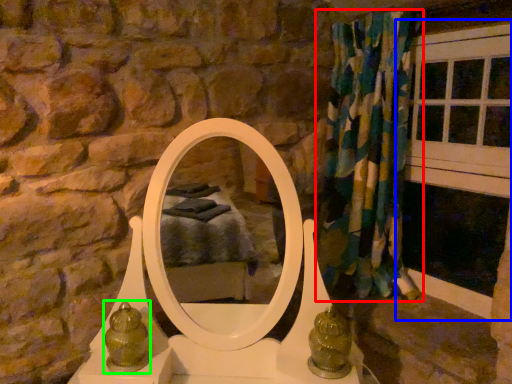
Question: Which object is positioned closest to curtain (highlighted by a red box)? Select from window frame (highlighted by a blue box) and antique (highlighted by a green box).

Choices:
 (A) window frame
 (B) antique

Answer: (A)